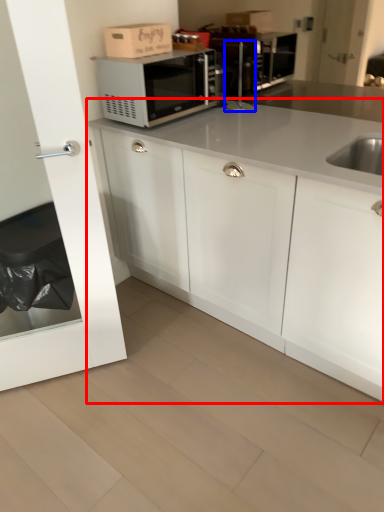
Question: Which of the following is the farthest to the observer, cabinetry (highlighted by a red box) or faucet (highlighted by a blue box)?

Choices:
 (A) cabinetry
 (B) faucet

Answer: (B)